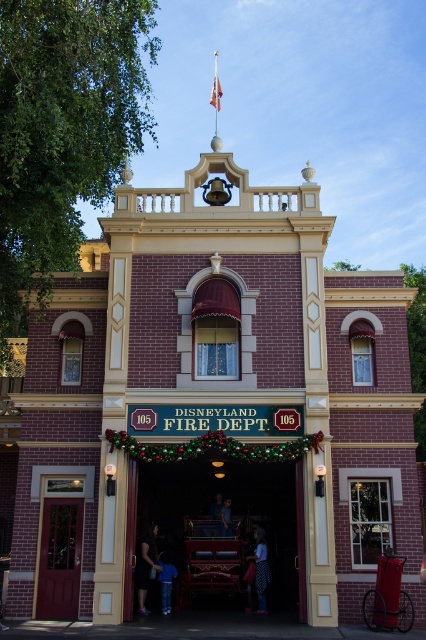
Question: Which point is closer to the camera?

Choices:
 (A) dotted fabric dress at center
 (B) matte red door at center
 (C) shiny red fire truck at center

Answer: (C)

Question: Is shiny red fire truck at center above dark blue jeans at center?

Choices:
 (A) yes
 (B) no

Answer: (A)

Question: Which object is farther from the camera taking this photo?

Choices:
 (A) matte red door at center
 (B) dotted fabric dress at center
 (C) dark blue jeans at center

Answer: (C)

Question: In this image, where is matte red door at center located relative to blue denim jeans at lower center?

Choices:
 (A) left
 (B) right

Answer: (A)

Question: Is dotted fabric dress at center below blue denim jeans at lower center?

Choices:
 (A) no
 (B) yes

Answer: (A)

Question: Which is farther from the dark blue jeans at center?

Choices:
 (A) dark hair at center
 (B) dotted fabric dress at center

Answer: (A)